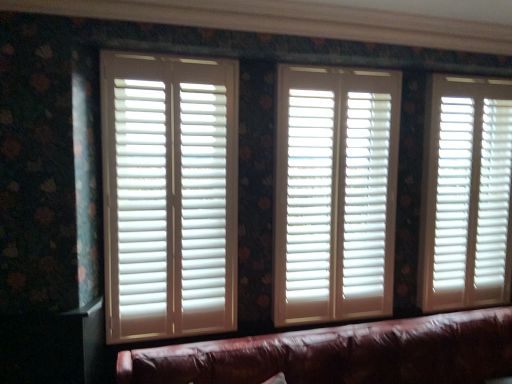
What do you see at coordinates (335, 193) in the screenshot?
I see `white matte wood blinds at center, which ranks as the second window blind in right-to-left order` at bounding box center [335, 193].

The height and width of the screenshot is (384, 512). What do you see at coordinates (340, 354) in the screenshot? I see `leather couch at lower center` at bounding box center [340, 354].

Where is `white matte wood blinds at center, which ranks as the second window blind in right-to-left order`? white matte wood blinds at center, which ranks as the second window blind in right-to-left order is located at coordinates (335, 193).

Does white matte wood blinds at center, which ranks as the second window blind in right-to-left order, appear on the right side of white matte blinds at right, which appears as the 1th window blind when viewed from the right?

In fact, white matte wood blinds at center, which ranks as the second window blind in right-to-left order, is to the left of white matte blinds at right, which appears as the 1th window blind when viewed from the right.

Is white matte wood blinds at center, the second window blind in the left-to-right sequence, located outside white matte blinds at right, which is the third window blind in left-to-right order?

Indeed, white matte wood blinds at center, the second window blind in the left-to-right sequence, is completely outside white matte blinds at right, which is the third window blind in left-to-right order.

Looking at this image, is white matte wood blinds at center, which ranks as the second window blind in right-to-left order, further to the viewer compared to white matte blinds at right, which appears as the 1th window blind when viewed from the right?

No, the depth of white matte wood blinds at center, which ranks as the second window blind in right-to-left order, is less than that of white matte blinds at right, which appears as the 1th window blind when viewed from the right.

At what (x,y) coordinates should I click in order to perform the action: click on window blind behind the white matte wood blinds at center, the second window blind in the left-to-right sequence. Please return your answer as a coordinate pair (x, y). Looking at the image, I should click on (466, 194).

From the image's perspective, which object appears higher, white matte blinds at right, which is the third window blind in left-to-right order, or leather couch at lower center?

white matte blinds at right, which is the third window blind in left-to-right order, from the image's perspective.

Considering their positions, is white matte blinds at right, which is the third window blind in left-to-right order, located in front of or behind leather couch at lower center?

white matte blinds at right, which is the third window blind in left-to-right order, is positioned farther from the viewer than leather couch at lower center.

From their relative heights in the image, would you say white matte blinds at right, which is the third window blind in left-to-right order, is taller or shorter than leather couch at lower center?

Considering their sizes, white matte blinds at right, which is the third window blind in left-to-right order, has more height than leather couch at lower center.

This screenshot has width=512, height=384. Find the location of `studio couch in front of the white matte blinds at right, which appears as the 1th window blind when viewed from the right`. studio couch in front of the white matte blinds at right, which appears as the 1th window blind when viewed from the right is located at coordinates (340, 354).

Which object is positioned more to the right, white matte blinds at left, the first window blind in the left-to-right sequence, or white matte blinds at right, which is the third window blind in left-to-right order?

white matte blinds at right, which is the third window blind in left-to-right order.

Is white matte blinds at left, the first window blind in the left-to-right sequence, positioned beyond the bounds of white matte blinds at right, which appears as the 1th window blind when viewed from the right?

Yes, white matte blinds at left, the first window blind in the left-to-right sequence, is not within white matte blinds at right, which appears as the 1th window blind when viewed from the right.

Which of these two, white matte blinds at left, which appears as the third window blind when viewed from the right, or white matte blinds at right, which appears as the 1th window blind when viewed from the right, stands taller?

white matte blinds at right, which appears as the 1th window blind when viewed from the right, is taller.

From the picture: Is white matte blinds at left, which appears as the third window blind when viewed from the right, oriented towards white matte blinds at right, which appears as the 1th window blind when viewed from the right?

No.

What are the coordinates of `window blind located above the white matte blinds at left, which appears as the third window blind when viewed from the right (from a real-world perspective)` in the screenshot? It's located at (335, 193).

Is white matte blinds at left, the first window blind in the left-to-right sequence, with white matte wood blinds at center, the second window blind in the left-to-right sequence?

No, white matte blinds at left, the first window blind in the left-to-right sequence, is not making contact with white matte wood blinds at center, the second window blind in the left-to-right sequence.

Does white matte blinds at left, the first window blind in the left-to-right sequence, lie behind white matte wood blinds at center, the second window blind in the left-to-right sequence?

That is False.

Is leather couch at lower center to the right of white matte blinds at right, which appears as the 1th window blind when viewed from the right, from the viewer's perspective?

No.

Considering the sizes of leather couch at lower center and white matte blinds at right, which is the third window blind in left-to-right order, in the image, is leather couch at lower center wider or thinner than white matte blinds at right, which is the third window blind in left-to-right order,?

Considering their sizes, leather couch at lower center looks broader than white matte blinds at right, which is the third window blind in left-to-right order.

In the image, is leather couch at lower center positioned in front of or behind white matte blinds at right, which appears as the 1th window blind when viewed from the right?

leather couch at lower center is positioned closer to the viewer than white matte blinds at right, which appears as the 1th window blind when viewed from the right.

From the image's perspective, relative to white matte blinds at right, which appears as the 1th window blind when viewed from the right, is leather couch at lower center above or below?

leather couch at lower center is situated lower than white matte blinds at right, which appears as the 1th window blind when viewed from the right, in the image.

Is white matte wood blinds at center, which ranks as the second window blind in right-to-left order, to the left of white matte blinds at left, the first window blind in the left-to-right sequence, from the viewer's perspective?

Incorrect, white matte wood blinds at center, which ranks as the second window blind in right-to-left order, is not on the left side of white matte blinds at left, the first window blind in the left-to-right sequence.

Is white matte wood blinds at center, which ranks as the second window blind in right-to-left order, shorter than white matte blinds at left, which appears as the third window blind when viewed from the right?

Incorrect, the height of white matte wood blinds at center, which ranks as the second window blind in right-to-left order, does not fall short of that of white matte blinds at left, which appears as the third window blind when viewed from the right.

What are the coordinates of `window blind above the white matte blinds at left, the first window blind in the left-to-right sequence (from a real-world perspective)` in the screenshot? It's located at (335, 193).

Is white matte wood blinds at center, the second window blind in the left-to-right sequence, beside white matte blinds at left, which appears as the third window blind when viewed from the right?

white matte wood blinds at center, the second window blind in the left-to-right sequence, is not next to white matte blinds at left, which appears as the third window blind when viewed from the right, and they're not touching.

Is leather couch at lower center next to white matte wood blinds at center, which ranks as the second window blind in right-to-left order, and touching it?

No, leather couch at lower center is not beside white matte wood blinds at center, which ranks as the second window blind in right-to-left order.

Is leather couch at lower center shorter than white matte wood blinds at center, which ranks as the second window blind in right-to-left order?

Indeed, leather couch at lower center has a lesser height compared to white matte wood blinds at center, which ranks as the second window blind in right-to-left order.

Does point (462, 328) lie in front of point (308, 180)?

That is True.

Identify the location of window blind to the right of white matte wood blinds at center, the second window blind in the left-to-right sequence. The width and height of the screenshot is (512, 384). (466, 194).

In order to click on the 2nd window blind above the leather couch at lower center (from the image's perspective) in this screenshot , I will do `click(466, 194)`.

From the image, which object appears to be nearer to white matte blinds at right, which appears as the 1th window blind when viewed from the right, leather couch at lower center or white matte blinds at left, the first window blind in the left-to-right sequence?

leather couch at lower center is closer to white matte blinds at right, which appears as the 1th window blind when viewed from the right.

From the image, which object appears to be farther from white matte wood blinds at center, which ranks as the second window blind in right-to-left order, white matte blinds at right, which appears as the 1th window blind when viewed from the right, or white matte blinds at left, which appears as the third window blind when viewed from the right?

white matte blinds at left, which appears as the third window blind when viewed from the right.

Considering their positions, is white matte blinds at right, which appears as the 1th window blind when viewed from the right, positioned further to white matte blinds at left, the first window blind in the left-to-right sequence, than leather couch at lower center?

white matte blinds at right, which appears as the 1th window blind when viewed from the right, is positioned further to the anchor white matte blinds at left, the first window blind in the left-to-right sequence.

When comparing their distances from white matte wood blinds at center, the second window blind in the left-to-right sequence, does white matte blinds at left, the first window blind in the left-to-right sequence, or leather couch at lower center seem further?

The object further to white matte wood blinds at center, the second window blind in the left-to-right sequence, is leather couch at lower center.

Looking at the image, which one is located closer to white matte blinds at left, which appears as the third window blind when viewed from the right, leather couch at lower center or white matte wood blinds at center, which ranks as the second window blind in right-to-left order?

white matte wood blinds at center, which ranks as the second window blind in right-to-left order, is closer to white matte blinds at left, which appears as the third window blind when viewed from the right.

From the image, which object appears to be nearer to white matte blinds at right, which is the third window blind in left-to-right order, white matte wood blinds at center, the second window blind in the left-to-right sequence, or leather couch at lower center?

white matte wood blinds at center, the second window blind in the left-to-right sequence.

Looking at the image, which one is located closer to leather couch at lower center, white matte wood blinds at center, which ranks as the second window blind in right-to-left order, or white matte blinds at left, the first window blind in the left-to-right sequence?

Based on the image, white matte wood blinds at center, which ranks as the second window blind in right-to-left order, appears to be nearer to leather couch at lower center.

In the scene shown: From the image, which object appears to be farther from white matte wood blinds at center, which ranks as the second window blind in right-to-left order, leather couch at lower center or white matte blinds at right, which is the third window blind in left-to-right order?

leather couch at lower center.

Identify the location of window blind between leather couch at lower center and white matte wood blinds at center, which ranks as the second window blind in right-to-left order, from front to back. (169, 195).

At what (x,y) coordinates should I click in order to perform the action: click on window blind between white matte blinds at left, which appears as the third window blind when viewed from the right, and white matte blinds at right, which appears as the 1th window blind when viewed from the right. Please return your answer as a coordinate pair (x, y). Looking at the image, I should click on (335, 193).

Find the location of a particular element. The width and height of the screenshot is (512, 384). studio couch between white matte blinds at left, the first window blind in the left-to-right sequence, and white matte blinds at right, which appears as the 1th window blind when viewed from the right, in the horizontal direction is located at coordinates pyautogui.click(x=340, y=354).